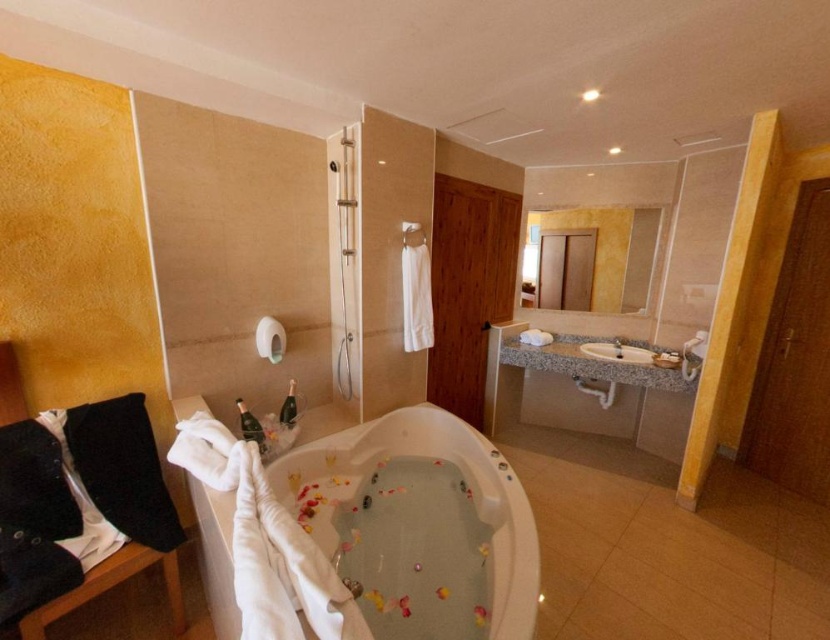
Question: Which of the following is the closest to the observer?

Choices:
 (A) white marble sink at center
 (B) white glossy bathtub at center

Answer: (B)

Question: Can you confirm if white glossy bathtub at center is bigger than white marble sink at center?

Choices:
 (A) yes
 (B) no

Answer: (A)

Question: Which object is farther from the camera taking this photo?

Choices:
 (A) white glossy bathtub at center
 (B) white marble sink at center

Answer: (B)

Question: Is white glossy bathtub at center bigger than white marble sink at center?

Choices:
 (A) no
 (B) yes

Answer: (B)

Question: Is white glossy bathtub at center positioned at the back of white marble sink at center?

Choices:
 (A) no
 (B) yes

Answer: (A)